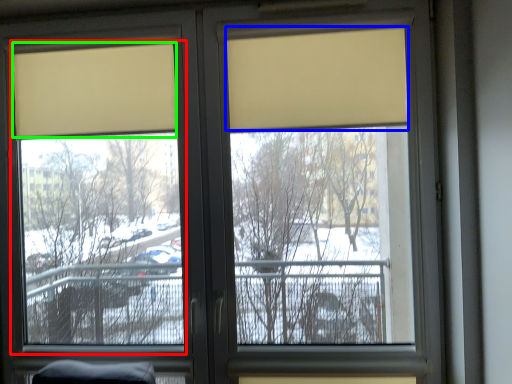
Question: Estimate the real-world distances between objects in this image. Which object is closer to window screen (highlighted by a red box), curtain (highlighted by a blue box) or curtain (highlighted by a green box)?

Choices:
 (A) curtain
 (B) curtain

Answer: (B)